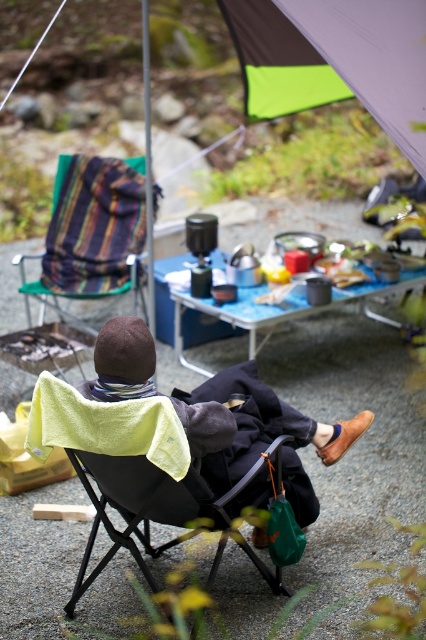
Question: Is black fabric chair at center bigger than striped fabric chair at left?

Choices:
 (A) no
 (B) yes

Answer: (A)

Question: Which point is farther to the camera?

Choices:
 (A) striped fabric chair at left
 (B) dark brown knit hat at center

Answer: (A)

Question: Which object is closer to the camera taking this photo?

Choices:
 (A) black fabric chair at center
 (B) blue fabric picnic table at center
 (C) dark brown knit hat at center

Answer: (A)

Question: Which point is farther from the camera taking this photo?

Choices:
 (A) (134, 332)
 (B) (46, 296)

Answer: (B)

Question: Is black fabric chair at center wider than striped fabric chair at left?

Choices:
 (A) no
 (B) yes

Answer: (A)

Question: Does dark brown knit hat at center have a greater width compared to black fabric chair at center?

Choices:
 (A) no
 (B) yes

Answer: (B)